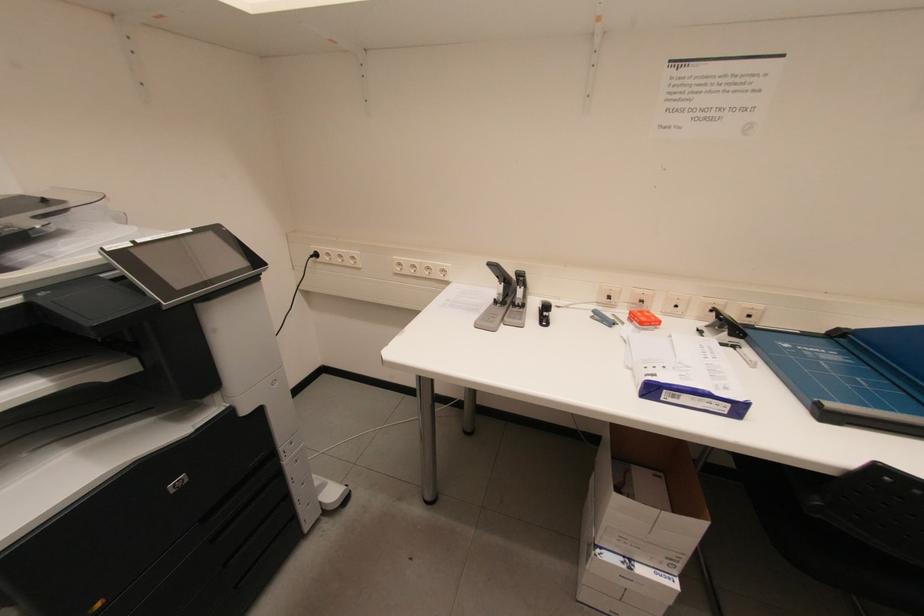
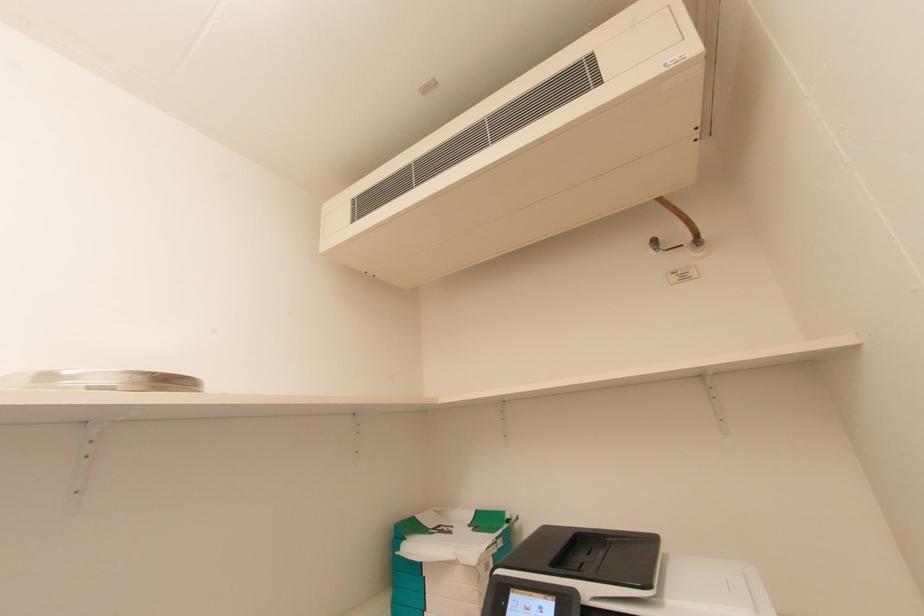
How did the camera likely rotate?

The camera's rotation is toward right-up.